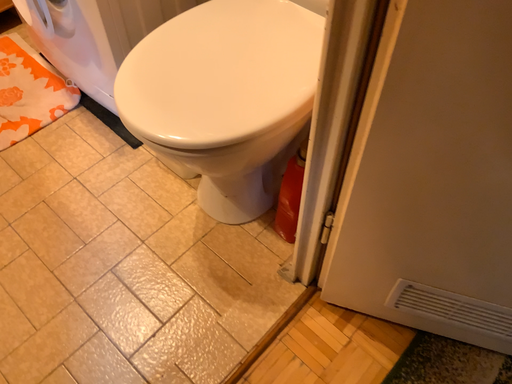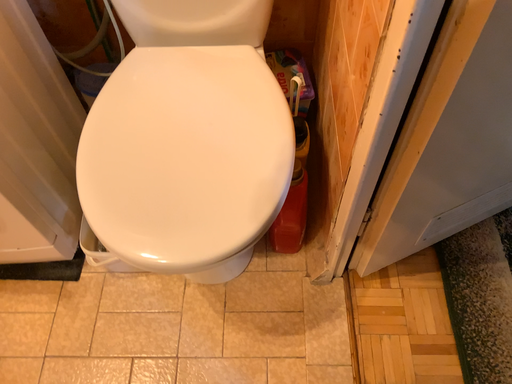
Question: Which way did the camera rotate in the video?

Choices:
 (A) rotated left
 (B) rotated right

Answer: (B)